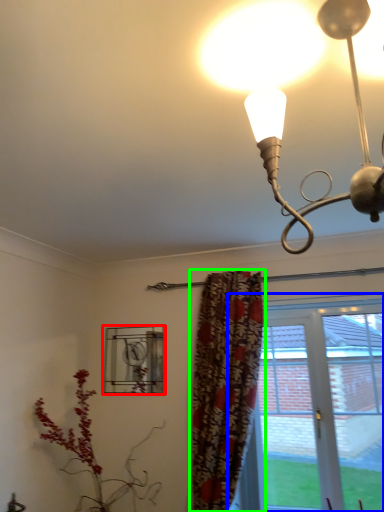
Question: Based on their relative distances, which object is nearer to window (highlighted by a red box)? Choose from window (highlighted by a blue box) and curtain (highlighted by a green box).

Choices:
 (A) window
 (B) curtain

Answer: (B)